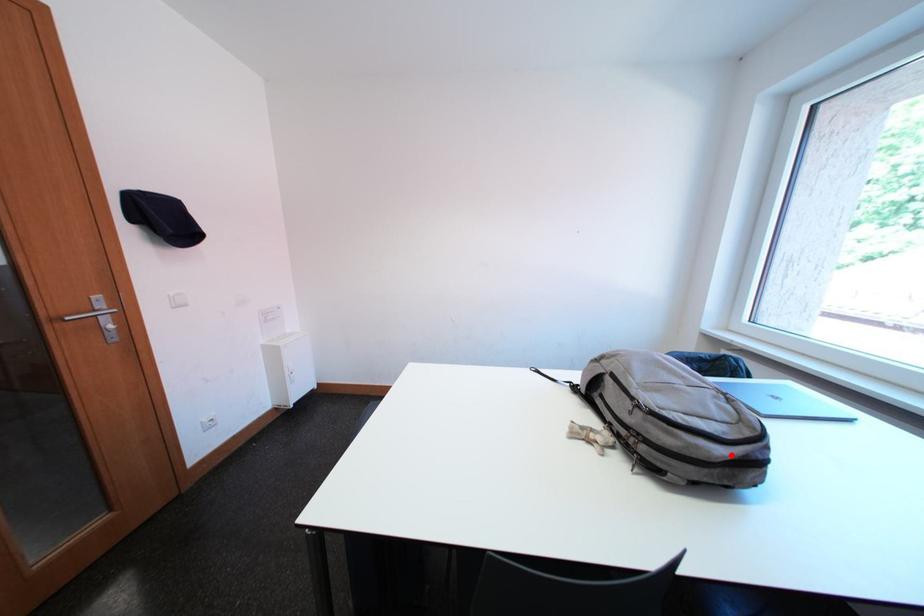
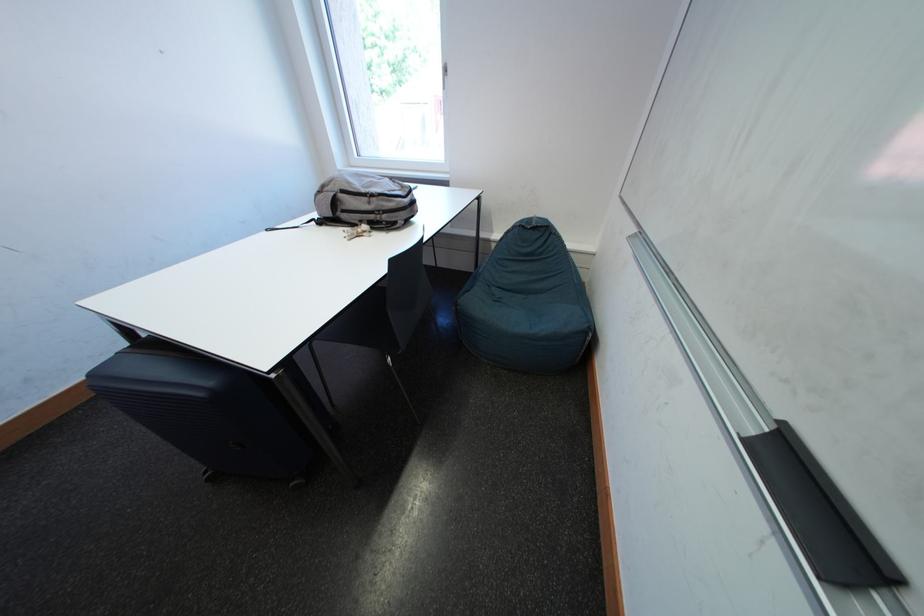
Where in the second image is the point corresponding to the highlighted location from the first image?

(416, 204)